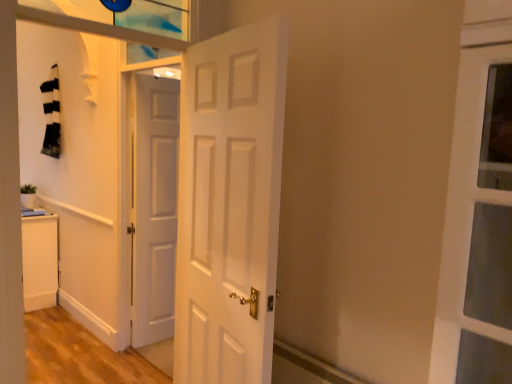
Question: From a real-world perspective, does green matte plant at lower left stand above white matte door at center, which is counted as the 1th door, starting from the front?

Choices:
 (A) no
 (B) yes

Answer: (A)

Question: Does green matte plant at lower left turn towards white matte door at center, the second door in the left-to-right sequence?

Choices:
 (A) yes
 (B) no

Answer: (B)

Question: From a real-world perspective, is green matte plant at lower left positioned under white matte door at center, the second door in the left-to-right sequence, based on gravity?

Choices:
 (A) no
 (B) yes

Answer: (B)

Question: Does green matte plant at lower left have a smaller size compared to white matte door at center, acting as the 2th door starting from the back?

Choices:
 (A) yes
 (B) no

Answer: (A)

Question: Can you confirm if green matte plant at lower left is positioned to the left of white matte door at center, the second door in the left-to-right sequence?

Choices:
 (A) no
 (B) yes

Answer: (B)

Question: Considering the relative sizes of green matte plant at lower left and white matte door at center, the 1th door from the right, in the image provided, is green matte plant at lower left thinner than white matte door at center, the 1th door from the right,?

Choices:
 (A) yes
 (B) no

Answer: (A)

Question: Is white matte cabinet at lower left inside white matte door at center, which is the 2th door in right-to-left order?

Choices:
 (A) no
 (B) yes

Answer: (A)

Question: Can you confirm if white matte door at center, which is the 2th door in right-to-left order, is bigger than white matte cabinet at lower left?

Choices:
 (A) no
 (B) yes

Answer: (A)

Question: From a real-world perspective, is white matte door at center, the 1th door in the left-to-right sequence, over white matte cabinet at lower left?

Choices:
 (A) yes
 (B) no

Answer: (A)

Question: Is the position of white matte door at center, which is the 2th door in right-to-left order, more distant than that of white matte cabinet at lower left?

Choices:
 (A) no
 (B) yes

Answer: (A)

Question: Does white matte door at center, which is the 2th door in right-to-left order, have a lesser height compared to white matte cabinet at lower left?

Choices:
 (A) no
 (B) yes

Answer: (A)

Question: Is white matte door at center, which is the 2th door in right-to-left order, outside white matte cabinet at lower left?

Choices:
 (A) no
 (B) yes

Answer: (B)

Question: Considering the relative sizes of white matte door at center, which is the 2th door in right-to-left order, and white matte door at center, the 1th door from the right, in the image provided, is white matte door at center, which is the 2th door in right-to-left order, smaller than white matte door at center, the 1th door from the right,?

Choices:
 (A) yes
 (B) no

Answer: (A)